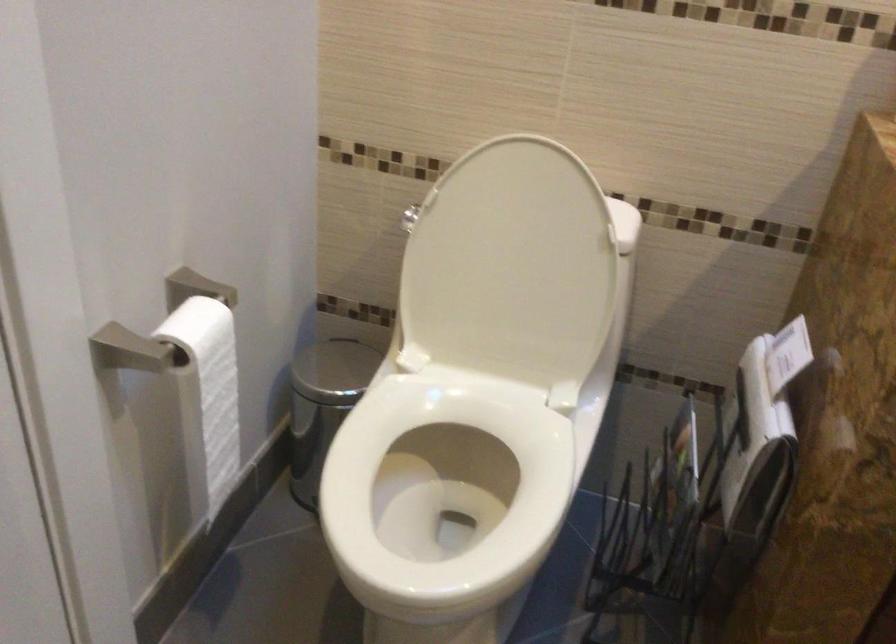
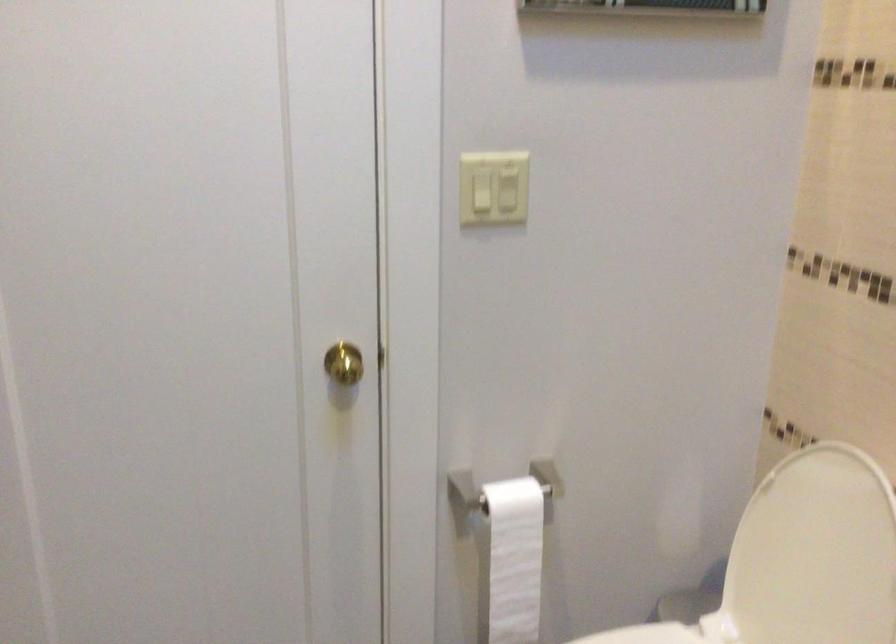
Find the pixel in the second image that matches (x=497, y=251) in the first image.

(813, 554)